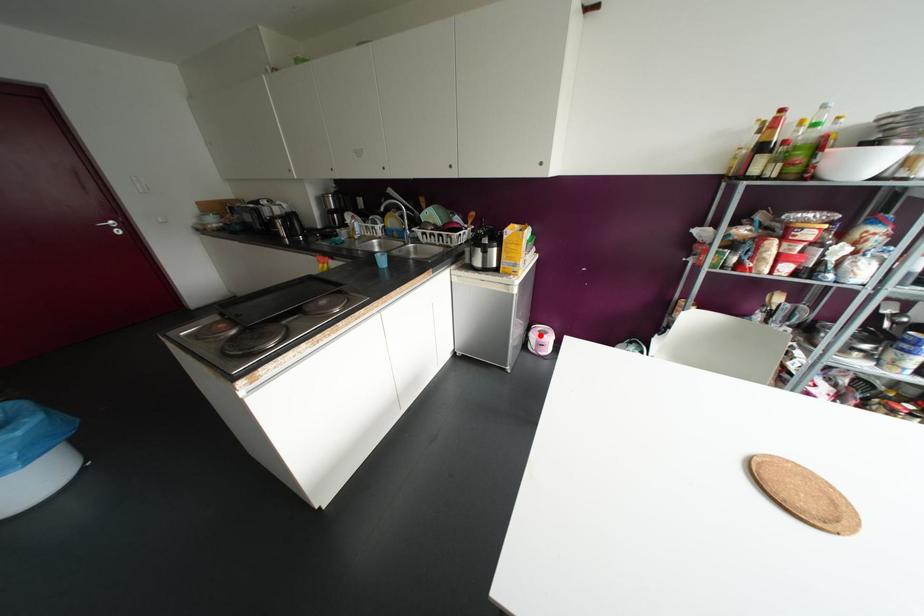
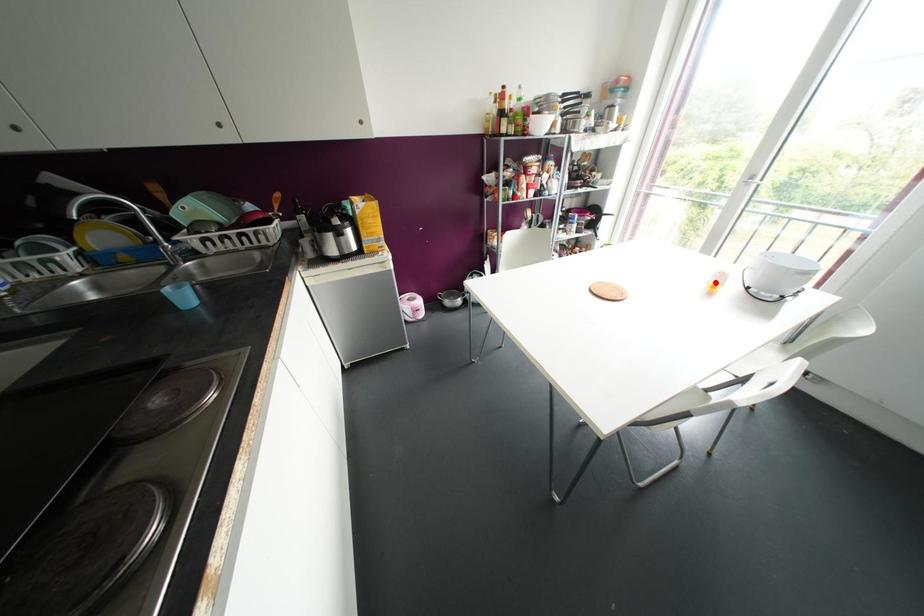
I am providing you with two images of the same scene from different viewpoints. A red point is marked on the first image and another point is marked on the second image. Does the point marked in image1 correspond to the same location as the one in image2?

No